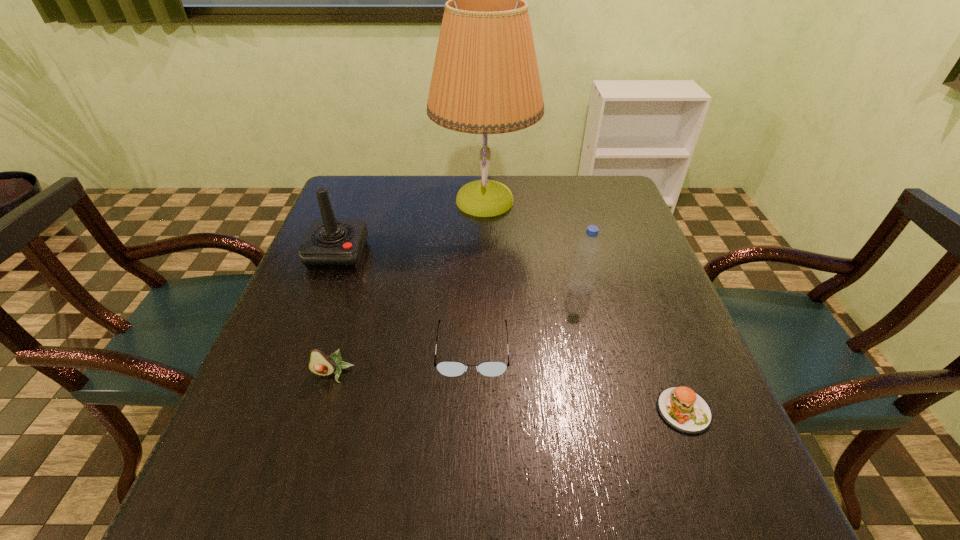
At what (x,y) coordinates should I click in order to perform the action: click on lamp. Please return your answer as a coordinate pair (x, y). Image resolution: width=960 pixels, height=540 pixels. Looking at the image, I should click on (485, 80).

Identify the location of the tallest object. The width and height of the screenshot is (960, 540). 485,80.

You are a GUI agent. You are given a task and a screenshot of the screen. Output one action in this format:
    pyautogui.click(x=<x>, y=<y>)
    Task: Click on the fifth nearest object
    This screenshot has width=960, height=540.
    Given the screenshot: What is the action you would take?
    pyautogui.click(x=329, y=244)

The width and height of the screenshot is (960, 540). Identify the location of the second object from right to left. (582, 280).

Find the location of a particular element. Image resolution: width=960 pixels, height=540 pixels. the third farthest object is located at coordinates (582, 280).

This screenshot has width=960, height=540. I want to click on avocado, so coord(320,363).

Locate an element on the screen. The width and height of the screenshot is (960, 540). spectacles is located at coordinates (447, 368).

Where is `the nearest object`? Image resolution: width=960 pixels, height=540 pixels. the nearest object is located at coordinates (683, 409).

Identify the location of the rightmost object. The image size is (960, 540). (683, 409).

You are a GUI agent. You are given a task and a screenshot of the screen. Output one action in this format:
    pyautogui.click(x=<x>, y=<y>)
    Task: Click on the vacant space situated on the side of the farthest object near the pull switch
    Image resolution: width=960 pixels, height=540 pixels.
    Given the screenshot: What is the action you would take?
    pyautogui.click(x=356, y=200)